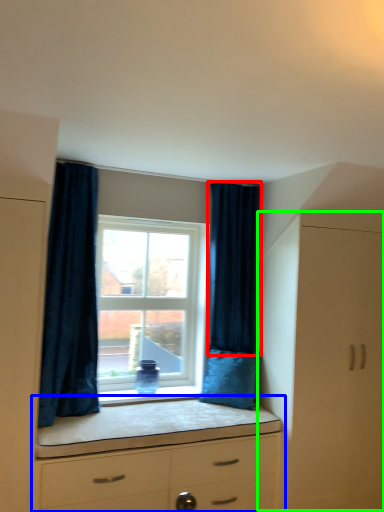
Question: Considering the real-world distances, which object is farthest from curtain (highlighted by a red box)? chest of drawers (highlighted by a blue box) or file cabinet (highlighted by a green box)?

Choices:
 (A) chest of drawers
 (B) file cabinet

Answer: (A)